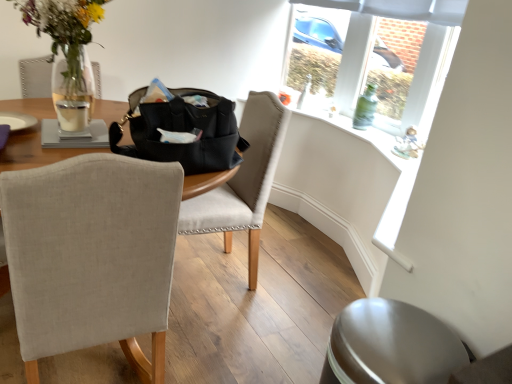
Locate an element on the screen. The image size is (512, 384). free spot above metallic silver swivel chair at lower right (from a real-world perspective) is located at coordinates (390, 330).